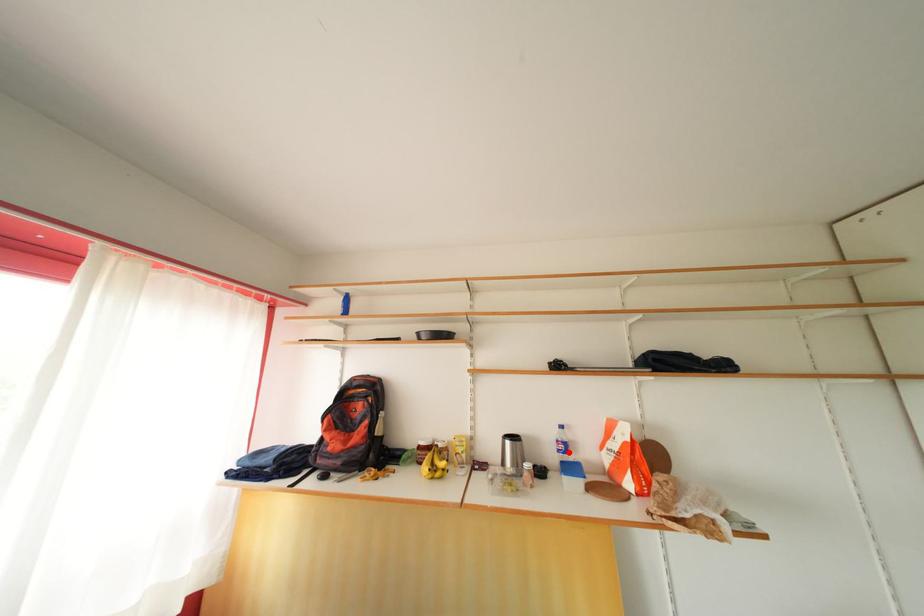
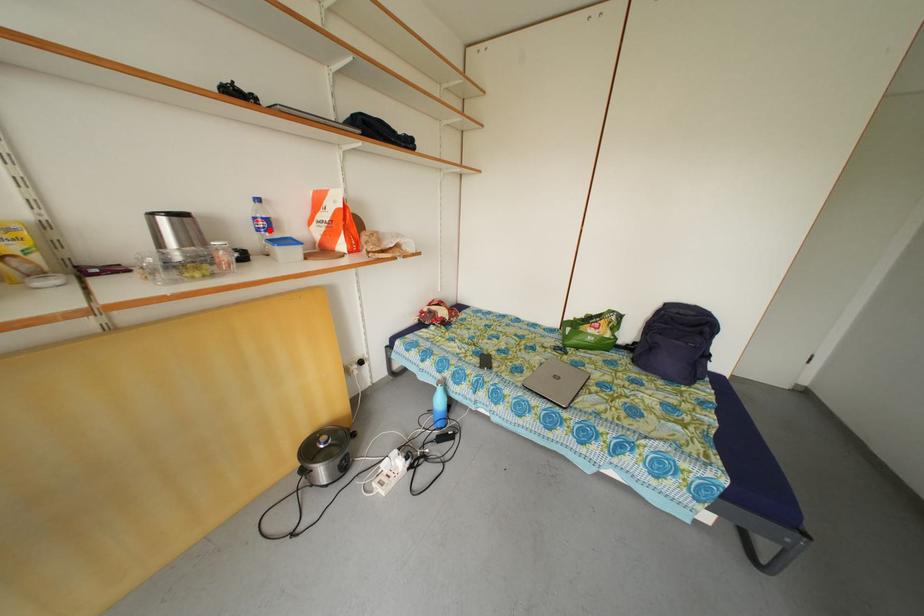
I am providing you with two images of the same scene from different viewpoints. A red point is marked on the first image and another point is marked on the second image. Are the points marked in image1 and image2 representing the same 3D position?

Yes